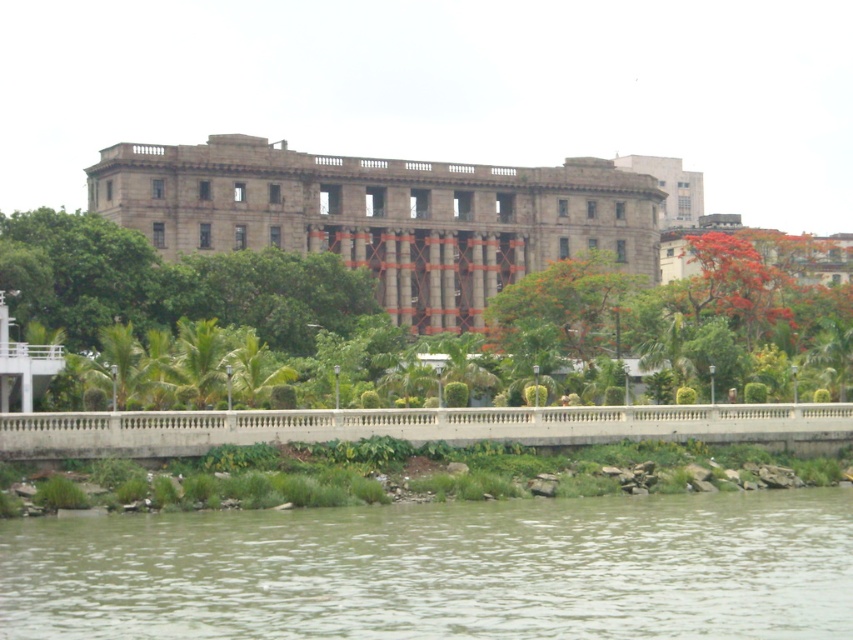
Is point (380, 541) farther from viewer compared to point (621, 172)?

No, it is not.

Can you confirm if brown sedimentary water at lower center is positioned to the right of stone building at center?

Incorrect, brown sedimentary water at lower center is not on the right side of stone building at center.

Between point (9, 544) and point (410, 250), which one is positioned behind?

Point (410, 250)

Find the location of a particular element. This screenshot has width=853, height=640. brown sedimentary water at lower center is located at coordinates (442, 570).